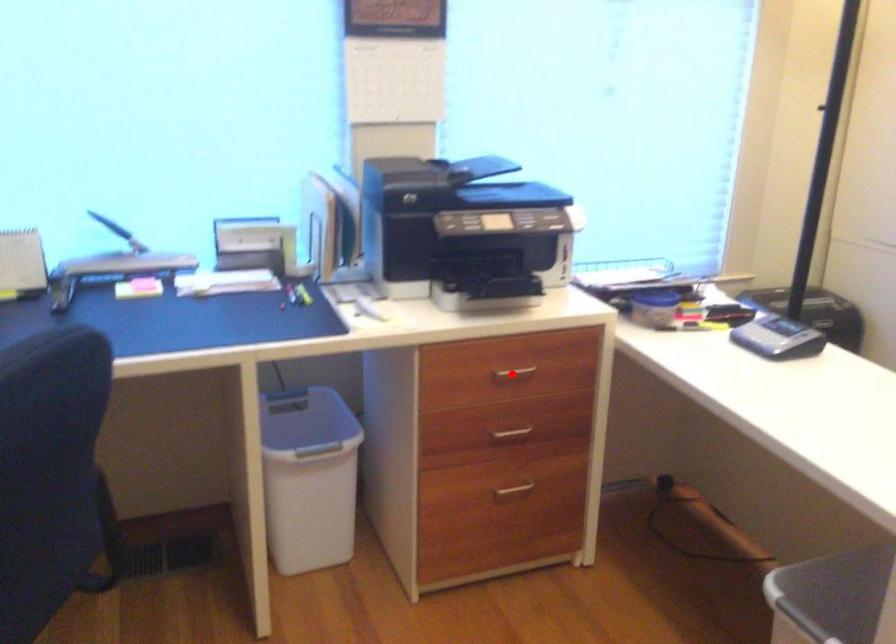
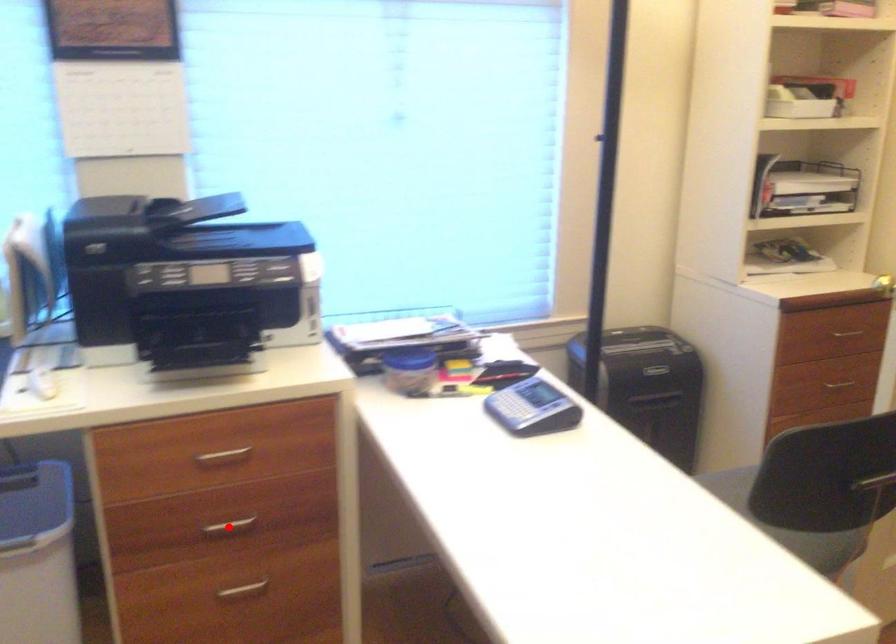
I am providing you with two images of the same scene from different viewpoints. A red point is marked on the first image and another point is marked on the second image. Do the highlighted points in image1 and image2 indicate the same real-world spot?

No